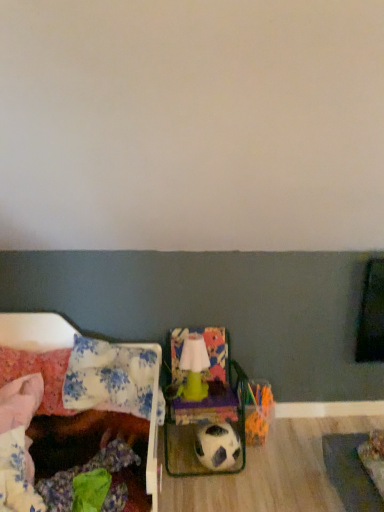
Question: Is floral fabric pillow at left, which is the first pillow in right-to-left order, behind matte green armchair at center?

Choices:
 (A) yes
 (B) no

Answer: (B)

Question: Can you confirm if floral fabric pillow at left, which is the first pillow in right-to-left order, is wider than matte green armchair at center?

Choices:
 (A) no
 (B) yes

Answer: (B)

Question: Is floral fabric pillow at left, which is the first pillow in right-to-left order, far away from matte green armchair at center?

Choices:
 (A) no
 (B) yes

Answer: (A)

Question: Does floral fabric pillow at left, which is the first pillow in right-to-left order, have a lesser height compared to matte green armchair at center?

Choices:
 (A) no
 (B) yes

Answer: (B)

Question: Considering the relative positions of floral fabric pillow at left, which is the first pillow in right-to-left order, and matte green armchair at center in the image provided, is floral fabric pillow at left, which is the first pillow in right-to-left order, to the left of matte green armchair at center from the viewer's perspective?

Choices:
 (A) yes
 (B) no

Answer: (A)

Question: In terms of height, does floral fabric bed at left look taller or shorter compared to black and white textured football at center?

Choices:
 (A) tall
 (B) short

Answer: (A)

Question: From a real-world perspective, relative to black and white textured football at center, is floral fabric bed at left vertically above or below?

Choices:
 (A) below
 (B) above

Answer: (B)

Question: In terms of size, does floral fabric bed at left appear bigger or smaller than black and white textured football at center?

Choices:
 (A) big
 (B) small

Answer: (A)

Question: Considering their positions, is floral fabric bed at left located in front of or behind black and white textured football at center?

Choices:
 (A) front
 (B) behind

Answer: (A)

Question: Considering the positions of point (21, 328) and point (8, 366), is point (21, 328) closer or farther from the camera than point (8, 366)?

Choices:
 (A) farther
 (B) closer

Answer: (A)

Question: Is floral fabric bed at left to the left or to the right of fluffy pink pillow at left, the first pillow viewed from the left, in the image?

Choices:
 (A) left
 (B) right

Answer: (B)

Question: Looking at the image, does floral fabric bed at left seem bigger or smaller compared to fluffy pink pillow at left, the first pillow viewed from the left?

Choices:
 (A) small
 (B) big

Answer: (B)

Question: Considering the positions of floral fabric bed at left and fluffy pink pillow at left, positioned as the second pillow in right-to-left order, in the image, is floral fabric bed at left taller or shorter than fluffy pink pillow at left, positioned as the second pillow in right-to-left order,?

Choices:
 (A) short
 (B) tall

Answer: (B)

Question: Looking at the image, does black and white textured football at center seem bigger or smaller compared to matte green armchair at center?

Choices:
 (A) small
 (B) big

Answer: (A)

Question: In the image, is black and white textured football at center positioned in front of or behind matte green armchair at center?

Choices:
 (A) behind
 (B) front

Answer: (A)